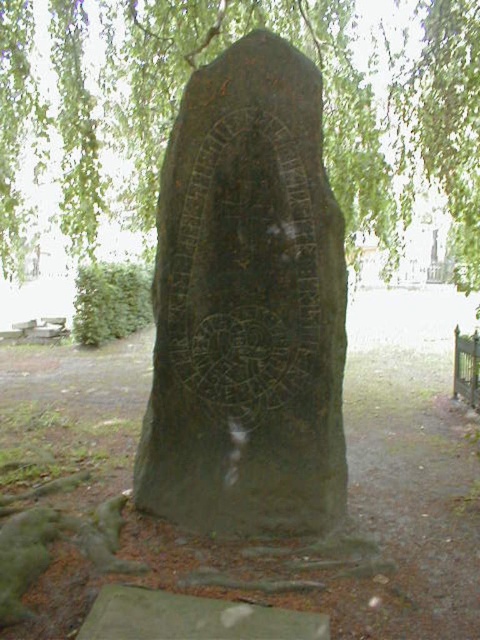
Is green stone monument at center wider than green leafy tree at upper center?

Yes.

Image resolution: width=480 pixels, height=640 pixels. Find the location of `green stone monument at center`. green stone monument at center is located at coordinates (247, 307).

Image resolution: width=480 pixels, height=640 pixels. In order to click on green stone monument at center in this screenshot , I will do `click(247, 307)`.

Who is lower down, green leafy tree at upper center or green stone carving at center?

green stone carving at center

Is green leafy tree at upper center below green stone carving at center?

No.

Between point (91, 108) and point (417, 410), which one is positioned in front?

Point (417, 410) is more forward.

Identify the location of green leafy tree at upper center. (182, 90).

Between green stone monument at center and green stone carving at center, which one is positioned lower?

green stone carving at center

Who is more distant from viewer, (192, 410) or (408, 586)?

Point (192, 410)

Locate an element on the screen. This screenshot has width=480, height=640. green stone monument at center is located at coordinates click(x=247, y=307).